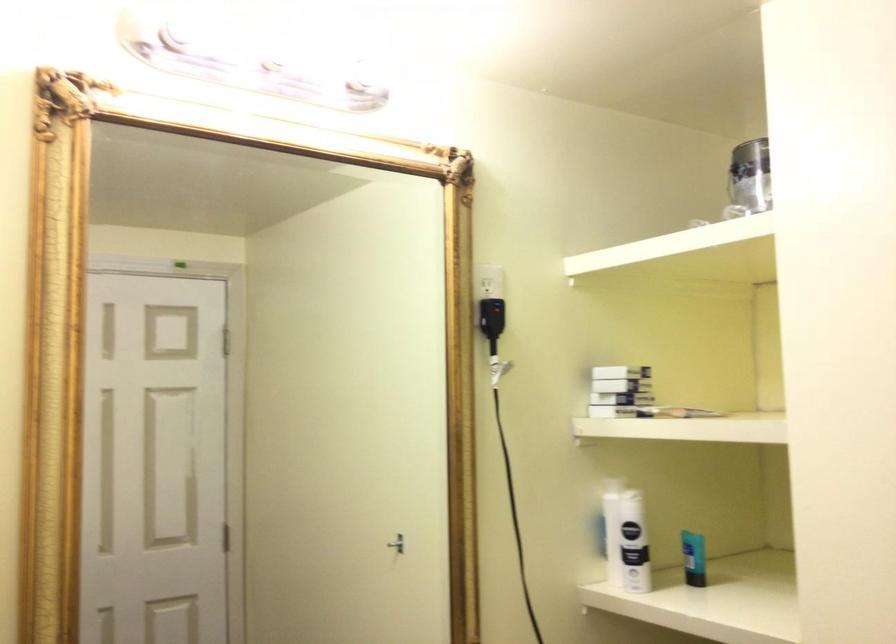
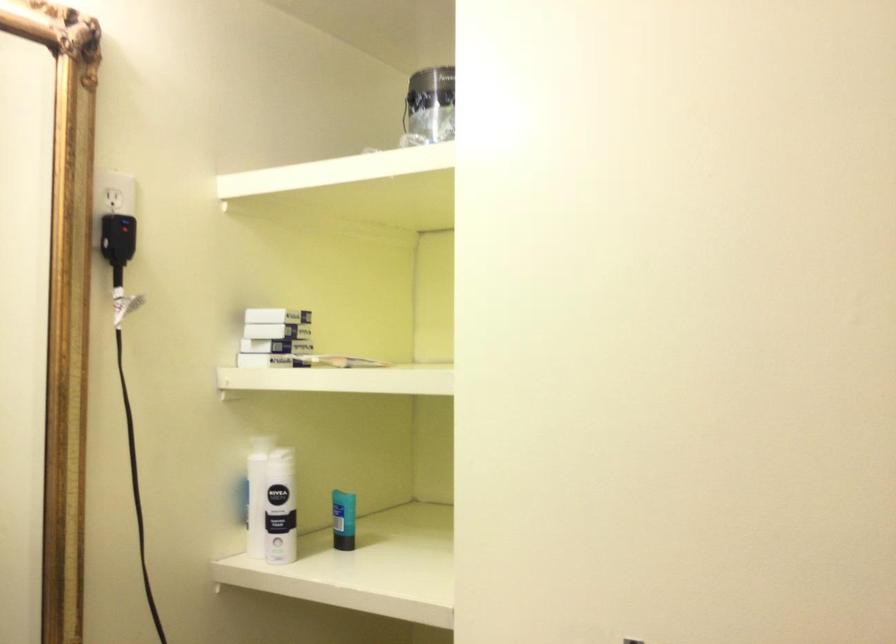
In the second image, find the point that corresponds to (632,386) in the first image.

(277, 330)